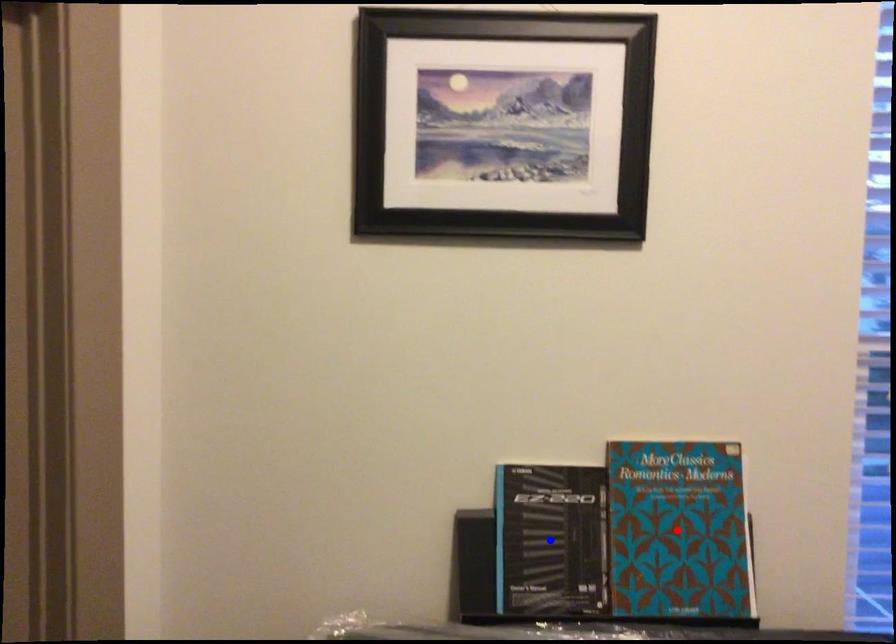
Question: In the image, two points are highlighted. Which point is nearer to the camera? Reply with the corresponding letter.

Choices:
 (A) blue point
 (B) red point

Answer: (B)